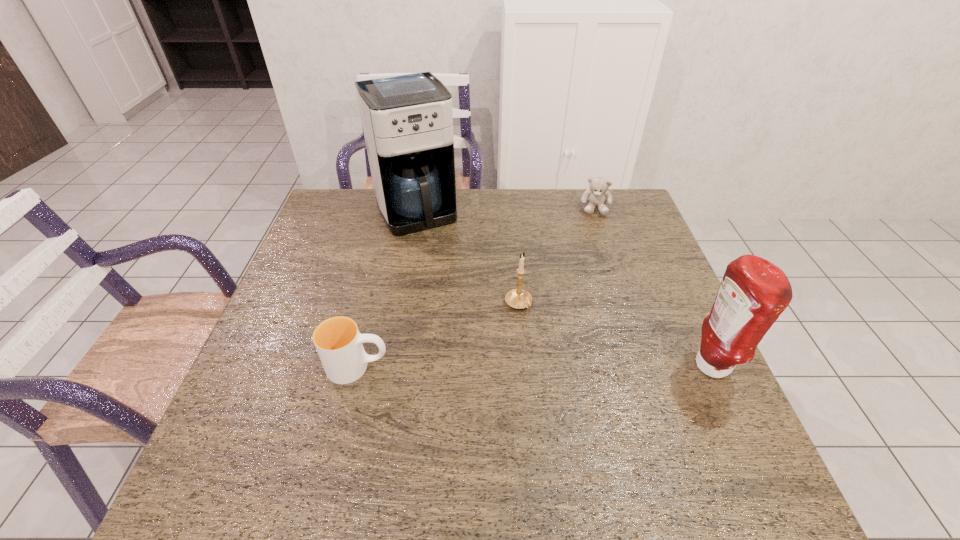
The image size is (960, 540). Find the location of `cup`. cup is located at coordinates (338, 341).

The width and height of the screenshot is (960, 540). In order to click on the second tallest object in this screenshot , I will do `click(753, 293)`.

You are a GUI agent. You are given a task and a screenshot of the screen. Output one action in this format:
    pyautogui.click(x=<x>, y=<y>)
    Task: Click on the rightmost object
    The width and height of the screenshot is (960, 540).
    Given the screenshot: What is the action you would take?
    pyautogui.click(x=753, y=293)

Locate an element on the screen. the second object from right to left is located at coordinates (596, 196).

Find the location of a particular element. The image size is (960, 540). coffee maker is located at coordinates (407, 119).

Find the location of a particular element. The image size is (960, 540). candle holder is located at coordinates (517, 298).

At what (x,y) coordinates should I click in order to perform the action: click on the third farthest object. Please return your answer as a coordinate pair (x, y). Looking at the image, I should click on (517, 298).

Identify the location of vacant space located 0.070m with the handle on the side of the cup. (420, 367).

Locate an element on the screen. The image size is (960, 540). blank space located 0.070m on the left of the second tallest object is located at coordinates (660, 366).

Locate an element on the screen. vacant space positioned 0.220m on the face of the teddy bear is located at coordinates (593, 261).